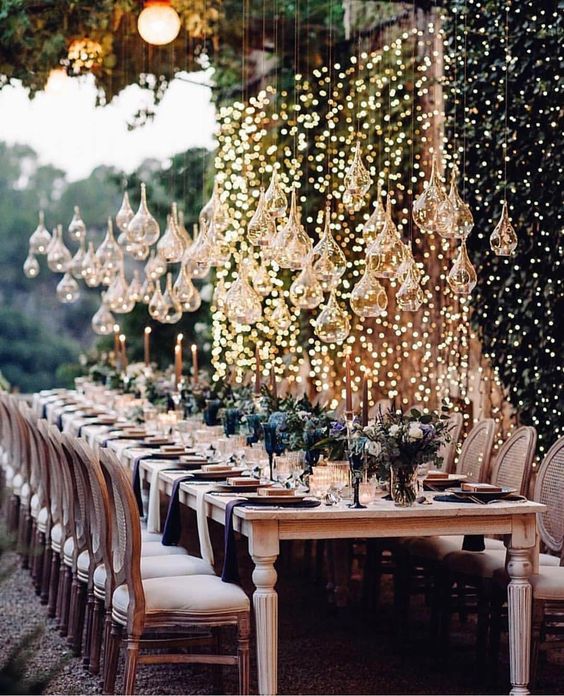
Find the location of a particular element. This screenshot has width=564, height=696. table leg is located at coordinates (525, 601).